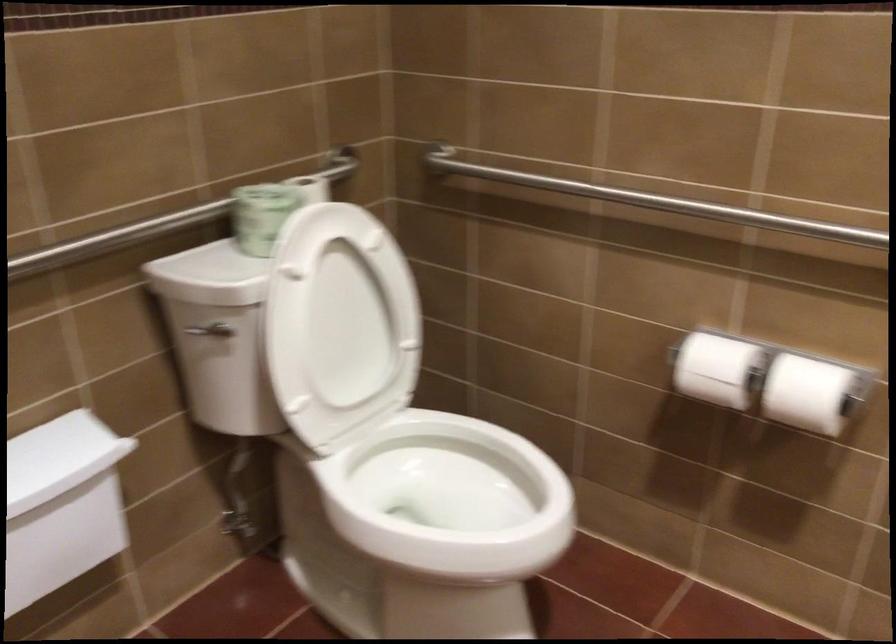
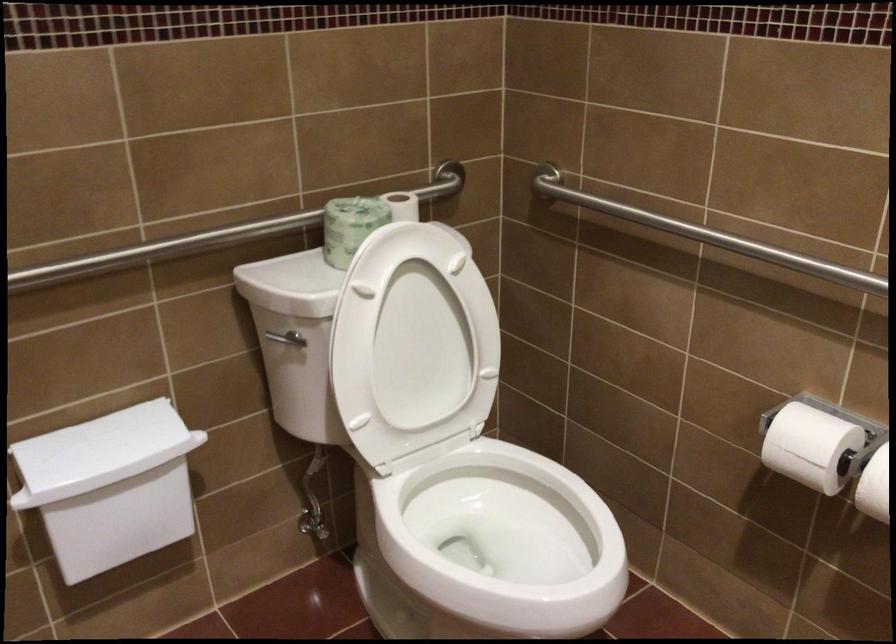
Find the pixel in the second image that matches [779,397] in the first image.

(874, 486)